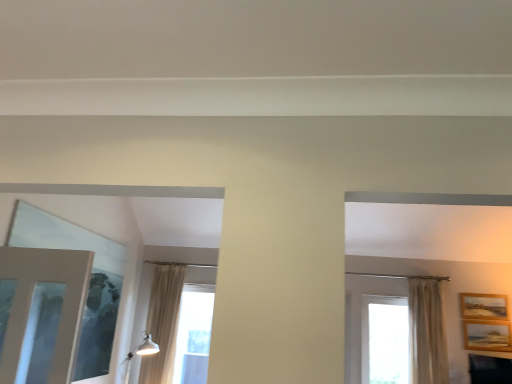
Question: From a real-world perspective, is transparent glass window at center, arranged as the second window when viewed from the left, positioned under wooden textured picture frame at right, the first picture frame from the bottom, based on gravity?

Choices:
 (A) no
 (B) yes

Answer: (B)

Question: Does transparent glass window at center, arranged as the second window when viewed from the left, come in front of wooden textured picture frame at right, which appears as the second picture frame when viewed from the top?

Choices:
 (A) yes
 (B) no

Answer: (B)

Question: Is transparent glass window at center, the 2th window in the right-to-left sequence, far from wooden textured picture frame at right, which appears as the second picture frame when viewed from the top?

Choices:
 (A) yes
 (B) no

Answer: (A)

Question: Does transparent glass window at center, arranged as the second window when viewed from the left, have a greater height compared to wooden textured picture frame at right, the first picture frame from the bottom?

Choices:
 (A) no
 (B) yes

Answer: (B)

Question: Is transparent glass window at center, arranged as the second window when viewed from the left, next to wooden textured picture frame at right, which appears as the second picture frame when viewed from the top, and touching it?

Choices:
 (A) yes
 (B) no

Answer: (B)

Question: From a real-world perspective, is white glossy light fixture at lower left above or below white sheer curtain at right?

Choices:
 (A) below
 (B) above

Answer: (A)

Question: In terms of size, does white glossy light fixture at lower left appear bigger or smaller than white sheer curtain at right?

Choices:
 (A) small
 (B) big

Answer: (A)

Question: Is white glossy light fixture at lower left in front of or behind white sheer curtain at right in the image?

Choices:
 (A) behind
 (B) front

Answer: (B)

Question: Looking at their shapes, would you say white glossy light fixture at lower left is wider or thinner than white sheer curtain at right?

Choices:
 (A) wide
 (B) thin

Answer: (A)

Question: Is wooden picture frame at upper right, which is the first picture frame in top-to-bottom order, in front of or behind white glossy light fixture at lower left in the image?

Choices:
 (A) behind
 (B) front

Answer: (A)

Question: From the image's perspective, is wooden picture frame at upper right, which is the second picture frame from bottom to top, positioned above or below white glossy light fixture at lower left?

Choices:
 (A) above
 (B) below

Answer: (A)

Question: Based on their positions, is wooden picture frame at upper right, which is the first picture frame in top-to-bottom order, located to the left or right of white glossy light fixture at lower left?

Choices:
 (A) right
 (B) left

Answer: (A)

Question: Choose the correct answer: Is wooden picture frame at upper right, which is the first picture frame in top-to-bottom order, inside white glossy light fixture at lower left or outside it?

Choices:
 (A) inside
 (B) outside

Answer: (B)

Question: From the image's perspective, is white sheer curtain at right positioned above or below black glossy tv at lower right?

Choices:
 (A) below
 (B) above

Answer: (B)

Question: From a real-world perspective, is white sheer curtain at right physically located above or below black glossy tv at lower right?

Choices:
 (A) above
 (B) below

Answer: (A)